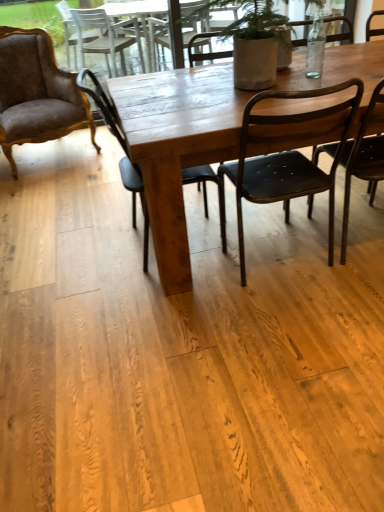
The width and height of the screenshot is (384, 512). What are the coordinates of `vacant region in front of matte black chair at center, positioned as the 2th chair in left-to-right order` in the screenshot? It's located at (164, 306).